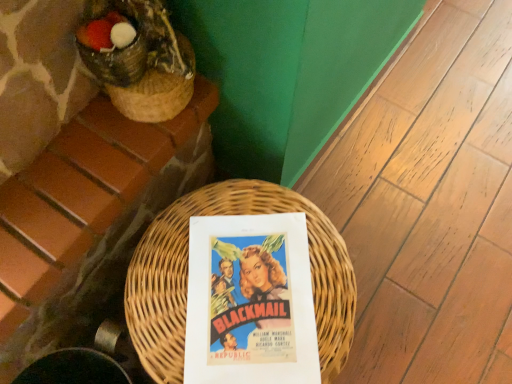
Question: Is woven wicker basket at center not within matte paper poster at center?

Choices:
 (A) yes
 (B) no

Answer: (A)

Question: From the image's perspective, is woven wicker basket at center under matte paper poster at center?

Choices:
 (A) no
 (B) yes

Answer: (B)

Question: Is woven wicker basket at center at the left side of matte paper poster at center?

Choices:
 (A) yes
 (B) no

Answer: (A)

Question: Does woven wicker basket at center have a greater height compared to matte paper poster at center?

Choices:
 (A) yes
 (B) no

Answer: (A)

Question: Can you confirm if woven wicker basket at center is wider than matte paper poster at center?

Choices:
 (A) no
 (B) yes

Answer: (B)

Question: Considering the relative sizes of woven wicker basket at center and matte paper poster at center in the image provided, is woven wicker basket at center thinner than matte paper poster at center?

Choices:
 (A) no
 (B) yes

Answer: (A)

Question: Can you confirm if matte paper poster at center is taller than woven wicker basket at center?

Choices:
 (A) yes
 (B) no

Answer: (B)

Question: Is matte paper poster at center at the right side of woven wicker basket at center?

Choices:
 (A) yes
 (B) no

Answer: (A)

Question: From a real-world perspective, does matte paper poster at center sit lower than woven wicker basket at center?

Choices:
 (A) no
 (B) yes

Answer: (A)

Question: Is matte paper poster at center in front of woven wicker basket at center?

Choices:
 (A) no
 (B) yes

Answer: (A)

Question: Considering the relative sizes of matte paper poster at center and woven wicker basket at center in the image provided, is matte paper poster at center thinner than woven wicker basket at center?

Choices:
 (A) yes
 (B) no

Answer: (A)

Question: Considering the relative sizes of matte paper poster at center and woven wicker basket at center in the image provided, is matte paper poster at center shorter than woven wicker basket at center?

Choices:
 (A) no
 (B) yes

Answer: (B)

Question: Is point (198, 271) closer or farther from the camera than point (164, 281)?

Choices:
 (A) farther
 (B) closer

Answer: (A)